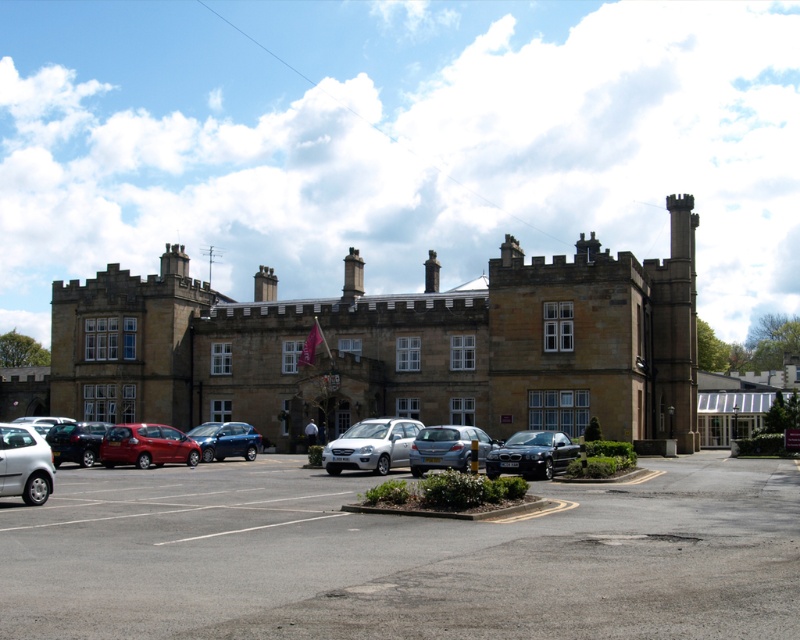
From the picture: You are a delivery driver who needs to park your truck between the brown stone building at center and the white glass building at right. The truck requires a 80 feet space to turn around. Is there enough space between them for your truck to turn around?

The brown stone building at center and white glass building at right are 79.32 feet apart. Since the required space is 80 feet, there is not enough space for the truck to turn around between them.

You are a delivery driver arriving at the historic building. Your task is to park your vehicle between the satin silver car at center and the silver metallic hatchback at lower left. Based on their positions, which vehicle should you position your car closer to in order to park between them?

The satin silver car at center is located below the silver metallic hatchback at lower left, so to park between them, you should position your car closer to the satin silver car at center since it is lower and the hatchback is higher up.

You are a visitor arriving at the historic building and need to park your car. You see a satin silver car at center and a silver metallic hatchback at lower left. Which parking spot is closer to the entrance of the building?

The silver metallic hatchback at lower left is closer to the entrance because it is positioned to the left of the satin silver car at center, which is further to the right.